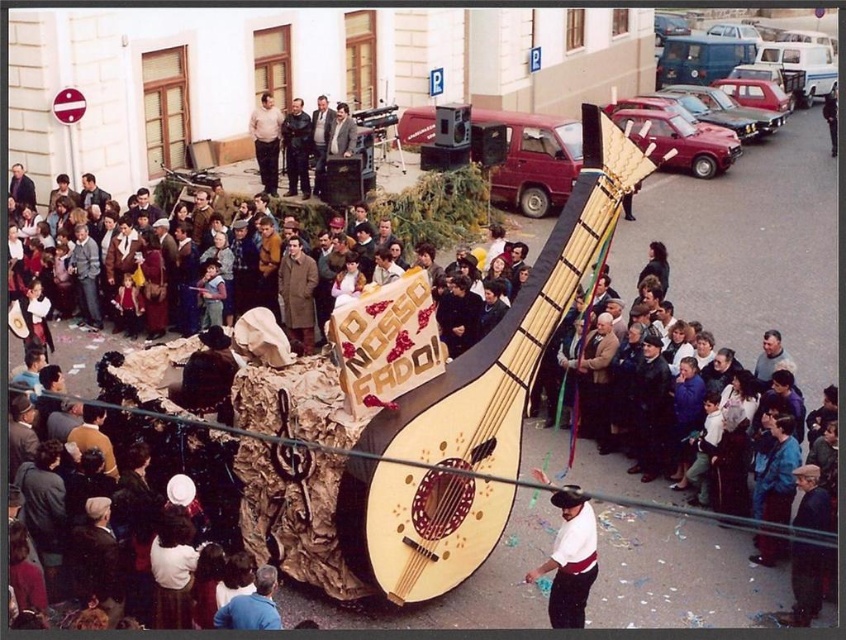
Consider the image. You are a photographer trying to capture both the wooden lute at center and the white cotton shirt at lower center in a single shot. Given their sizes, which object should you focus on to ensure both are clearly visible in the frame?

The wooden lute at center is bigger than the white cotton shirt at lower center, so you should focus on the wooden lute at center to ensure both are clearly visible in the frame.

You are a photographer trying to capture the float with both the white cotton shirt at lower center and the light brown leather jacket at upper center in the frame. Which object should you focus on first to ensure both are in the shot?

You should focus on the white cotton shirt at lower center first because it is larger in size than the light brown leather jacket at upper center, ensuring it fits within the frame before adjusting for the smaller jacket.